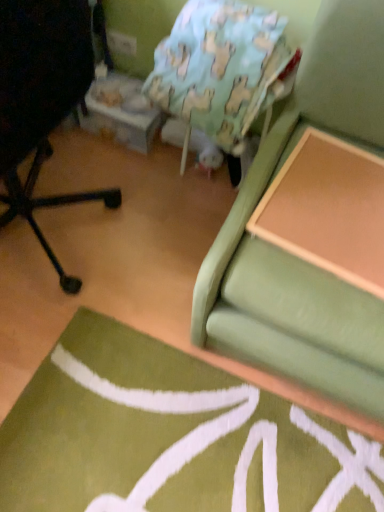
Question: Considering the relative sizes of light blue fabric bean bag chair at upper center and wooden table at upper right in the image provided, is light blue fabric bean bag chair at upper center thinner than wooden table at upper right?

Choices:
 (A) no
 (B) yes

Answer: (B)

Question: Is light blue fabric bean bag chair at upper center positioned in front of wooden table at upper right?

Choices:
 (A) no
 (B) yes

Answer: (A)

Question: Does light blue fabric bean bag chair at upper center have a greater height compared to wooden table at upper right?

Choices:
 (A) no
 (B) yes

Answer: (B)

Question: Is light blue fabric bean bag chair at upper center at the left side of wooden table at upper right?

Choices:
 (A) yes
 (B) no

Answer: (A)

Question: Are light blue fabric bean bag chair at upper center and wooden table at upper right making contact?

Choices:
 (A) yes
 (B) no

Answer: (B)

Question: Is light blue fabric bean bag chair at upper center not within wooden table at upper right?

Choices:
 (A) yes
 (B) no

Answer: (A)

Question: Does wooden table at upper right have a larger size compared to black matte chair at left?

Choices:
 (A) no
 (B) yes

Answer: (A)

Question: Is black matte chair at left completely or partially inside wooden table at upper right?

Choices:
 (A) yes
 (B) no

Answer: (B)

Question: Is wooden table at upper right positioned with its back to black matte chair at left?

Choices:
 (A) yes
 (B) no

Answer: (B)

Question: Is wooden table at upper right wider than black matte chair at left?

Choices:
 (A) no
 (B) yes

Answer: (A)

Question: From a real-world perspective, is wooden table at upper right on top of black matte chair at left?

Choices:
 (A) yes
 (B) no

Answer: (B)

Question: Can you confirm if wooden table at upper right is smaller than black matte chair at left?

Choices:
 (A) no
 (B) yes

Answer: (B)

Question: From the image's perspective, would you say black matte chair at left is shown under light blue fabric bean bag chair at upper center?

Choices:
 (A) yes
 (B) no

Answer: (A)